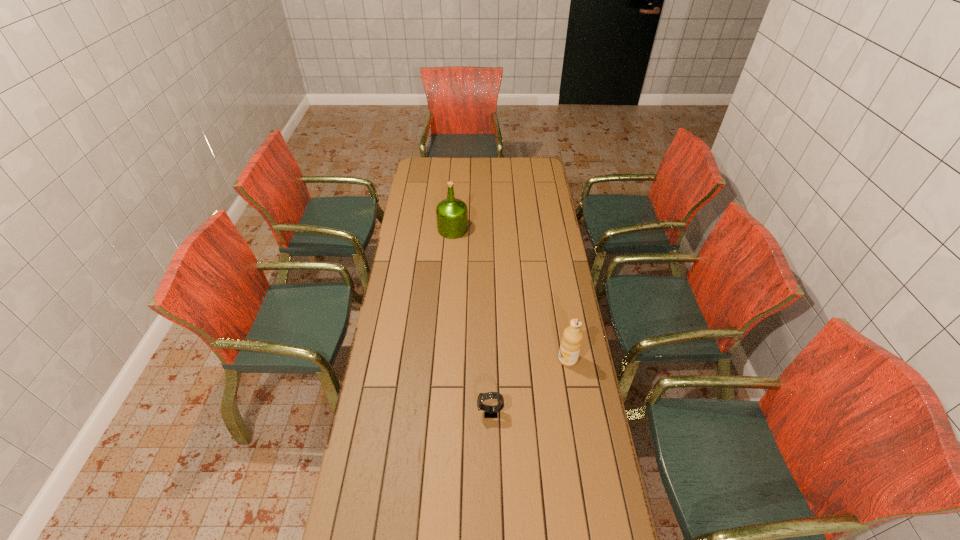
Locate an element on the screen. The image size is (960, 540). empty space between the shortest object and the nearer olive oil is located at coordinates (529, 386).

You are a GUI agent. You are given a task and a screenshot of the screen. Output one action in this format:
    pyautogui.click(x=<x>, y=<y>)
    Task: Click on the vacant space in between the watch and the second nearest object
    
    Given the screenshot: What is the action you would take?
    pyautogui.click(x=529, y=386)

Locate an element on the screen. The height and width of the screenshot is (540, 960). object identified as the second closest to the second nearest object is located at coordinates (452, 214).

Find the location of a particular element. the closest object to the farthest object is located at coordinates (571, 342).